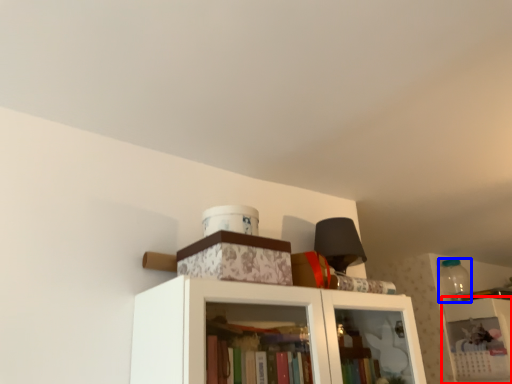
Question: Which point is further to the camera, shelf (highlighted by a red box) or bottle (highlighted by a blue box)?

Choices:
 (A) shelf
 (B) bottle

Answer: (B)